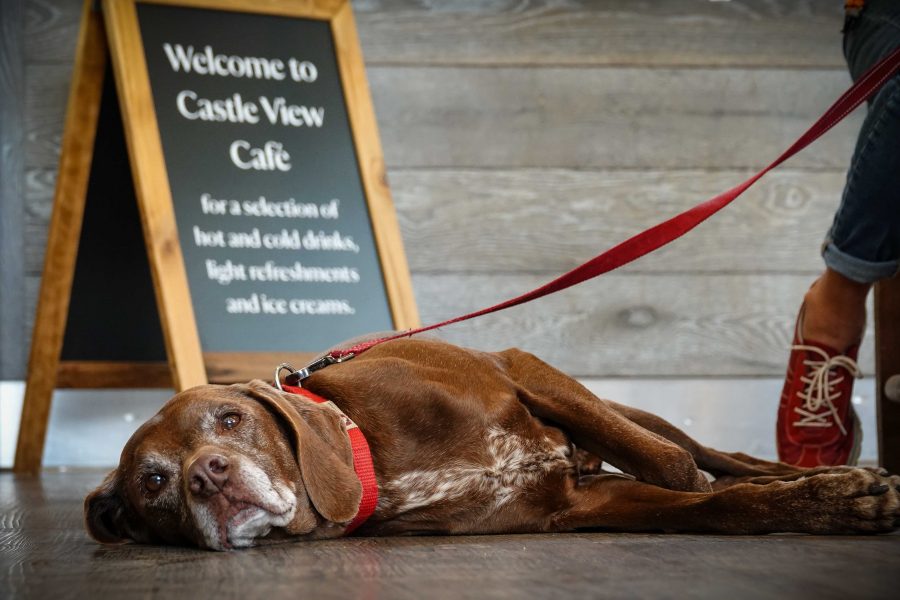
At what (x,y) coordinates should I click in order to perform the action: click on wooden stand. Please return your answer as a coordinate pair (x, y). The width and height of the screenshot is (900, 600). Looking at the image, I should click on (166, 210), (365, 153).